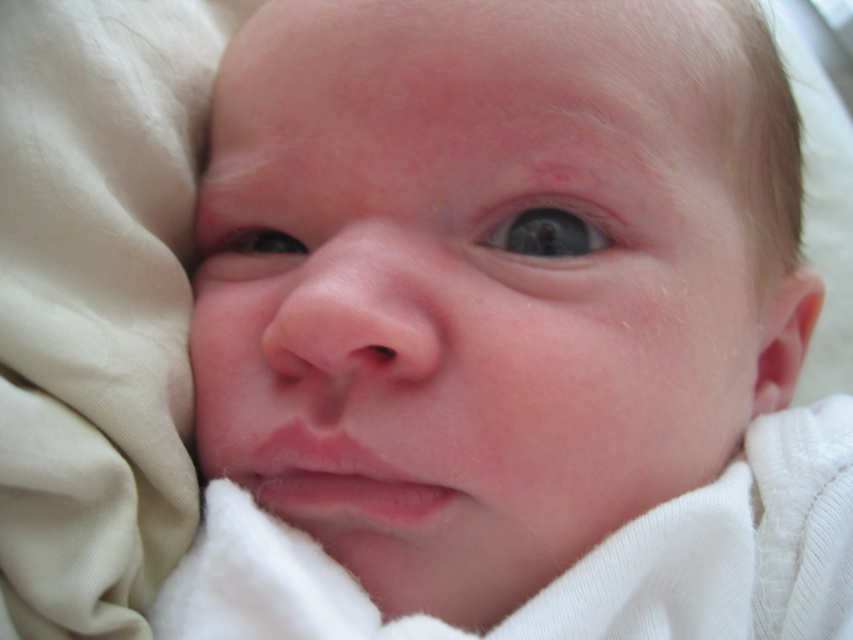
You are a photographer taking a closeup shot of a baby. You notice the smooth skin baby at center and the blue glossy eye at center. Which object is nearer to your camera lens?

The smooth skin baby at center is closer to the viewer than the blue glossy eye at center, so the smooth skin baby at center would be nearer to the camera lens.

You are a photographer taking a closeup shot of a baby. The camera is set to focus on objects 30 centimeters away. Will the smooth skin baby at center be in focus?

The smooth skin baby at center is 29.31 centimeters away from camera, which is just below the 30 centimeter focus setting. The baby will be slightly out of focus but very close to being sharp.

Looking at the baby in the image, which object is bigger between the smooth skin baby at center and the dark brown eye at center?

The smooth skin baby at center is larger in size than the dark brown eye at center.